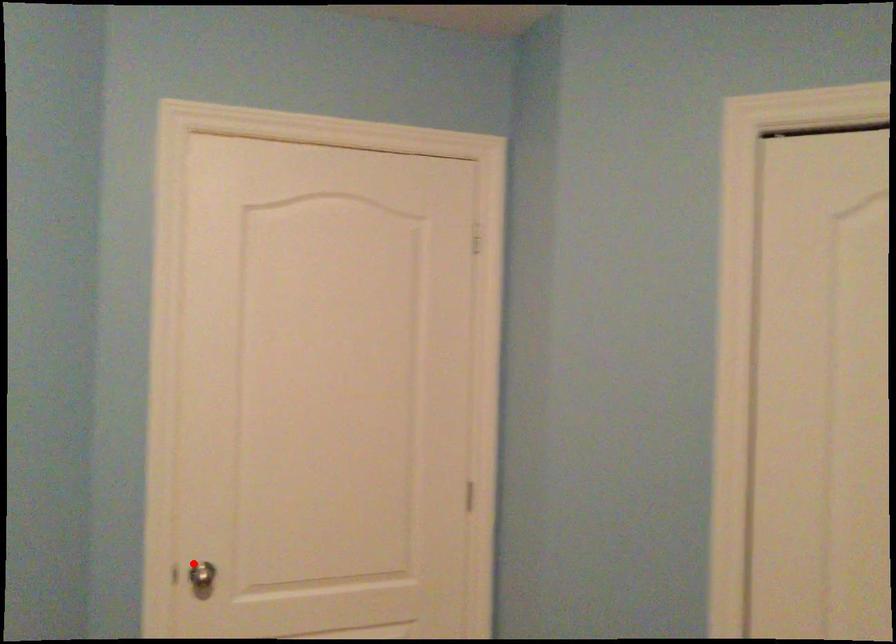
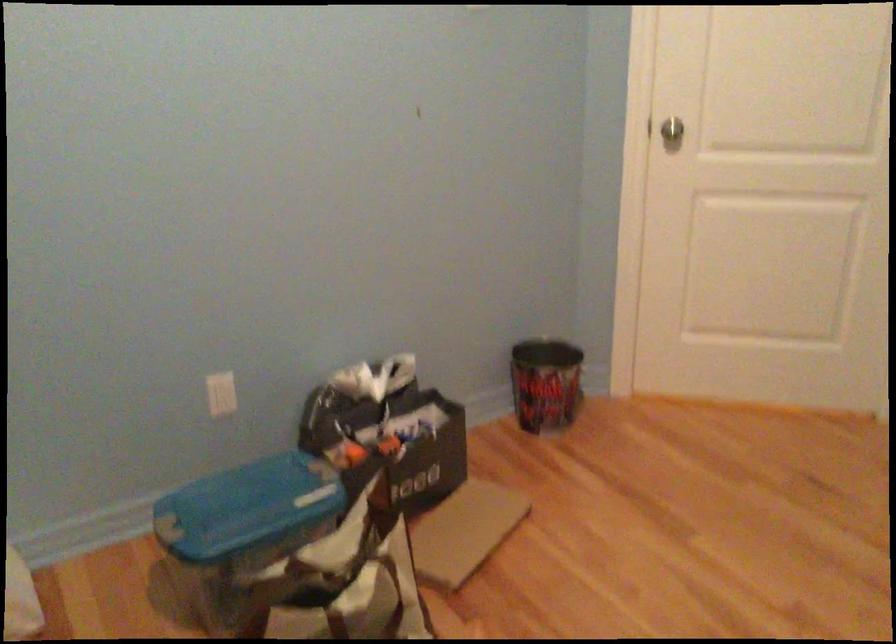
Question: A red point is marked in image1. In image2, is the corresponding 3D point closer to the camera or farther? Reply with the corresponding letter.

Choices:
 (A) The corresponding 3D point is closer.
 (B) The corresponding 3D point is farther.

Answer: (B)